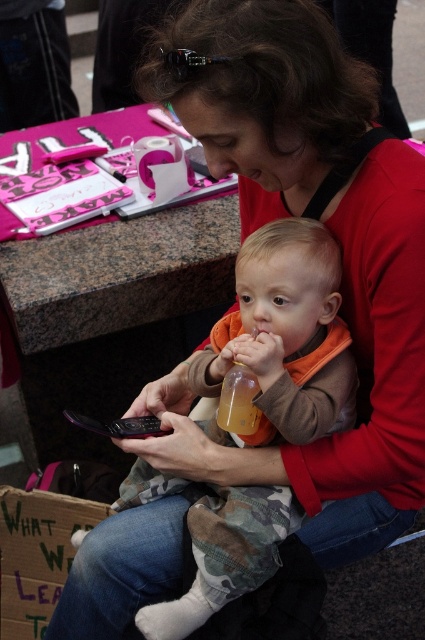
Question: Among these objects, which one is nearest to the camera?

Choices:
 (A) translucent plastic bottle at center
 (B) orange soft fabric baby at center

Answer: (B)

Question: Does orange soft fabric baby at center have a larger size compared to translucent plastic bottle at center?

Choices:
 (A) no
 (B) yes

Answer: (B)

Question: Which point appears closest to the camera in this image?

Choices:
 (A) (195, 365)
 (B) (251, 419)

Answer: (B)

Question: Can you confirm if orange soft fabric baby at center is positioned above translucent plastic bottle at center?

Choices:
 (A) yes
 (B) no

Answer: (B)

Question: Does orange soft fabric baby at center have a lesser width compared to translucent plastic bottle at center?

Choices:
 (A) yes
 (B) no

Answer: (B)